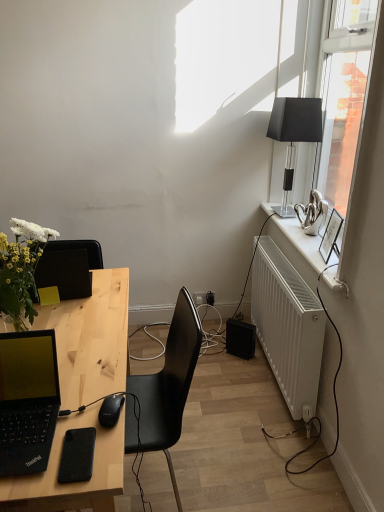
Where is `free area in between black matte mouse at lower left and black matte laptop at left`? This screenshot has height=512, width=384. free area in between black matte mouse at lower left and black matte laptop at left is located at coordinates (83, 414).